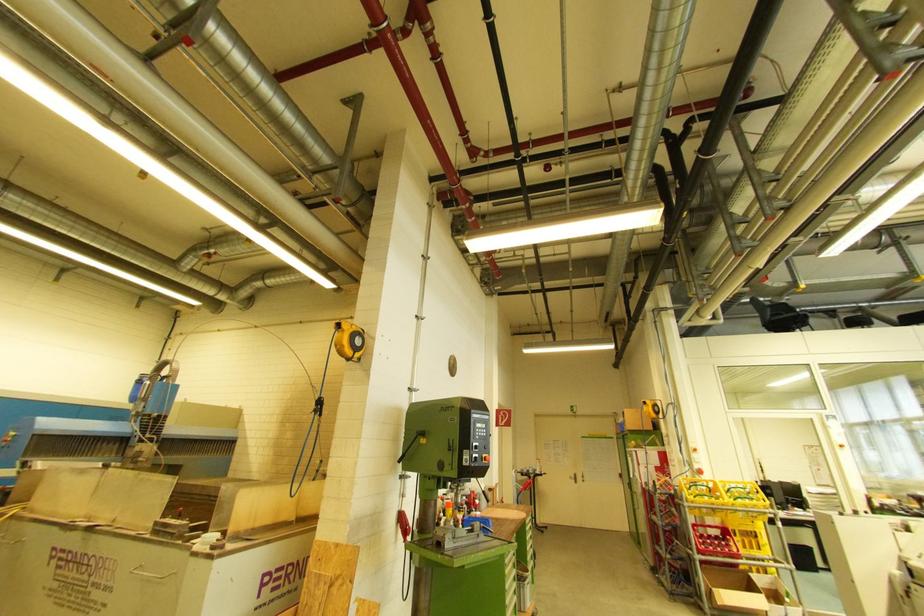
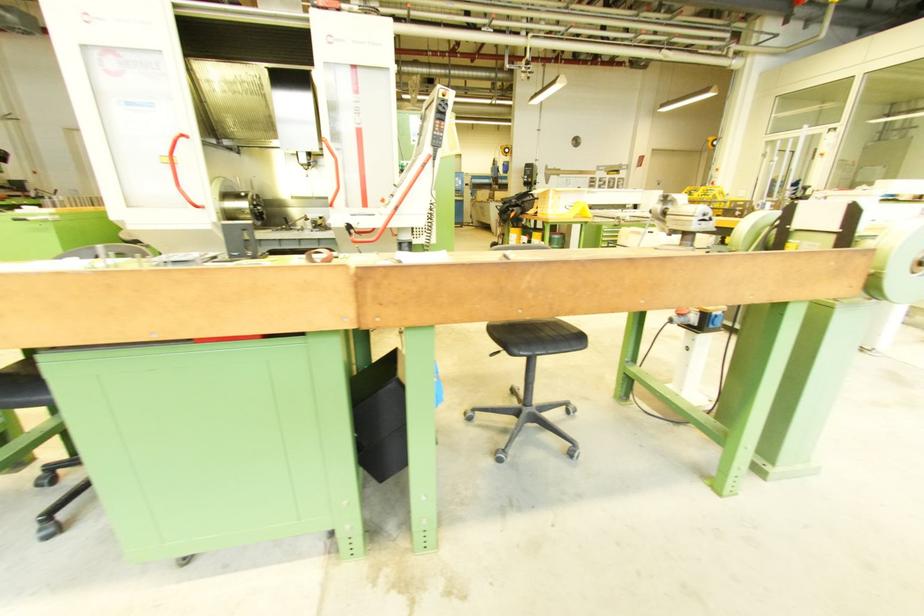
Question: I am providing you with two images of the same scene from different viewpoints. Which of the following objects are not visible in image2?

Choices:
 (A) red stop button
 (B) pendant joystick
 (C) metal vise handle
 (D) power socket

Answer: (A)